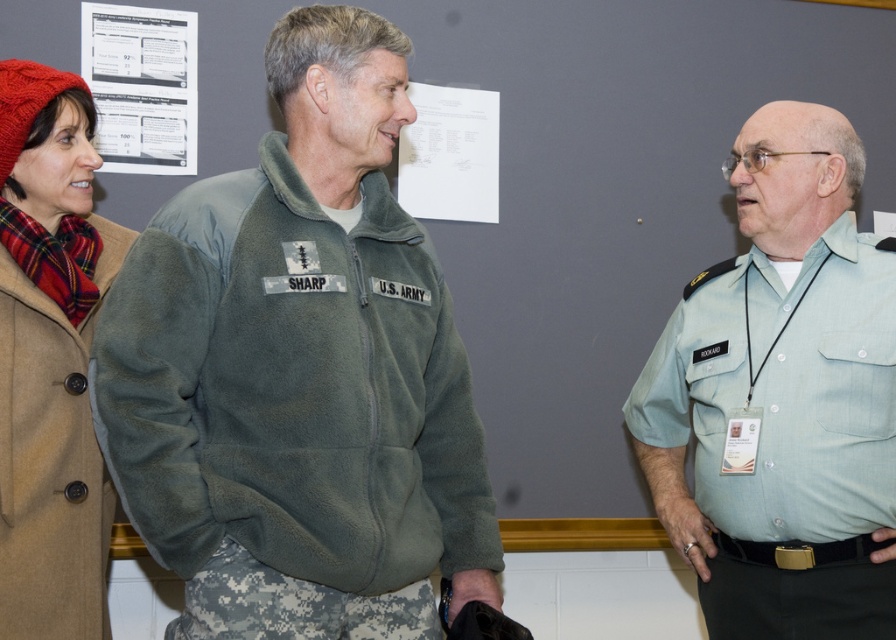
Question: Is green fleece jacket at center above white paper at upper center?

Choices:
 (A) no
 (B) yes

Answer: (A)

Question: Can you confirm if green fleece jacket at center is smaller than white paper at upper left?

Choices:
 (A) no
 (B) yes

Answer: (A)

Question: Where is light blue uniform at right located in relation to knitted wool hat at left in the image?

Choices:
 (A) left
 (B) right

Answer: (B)

Question: Based on their relative distances, which object is nearer to the light blue uniform at right?

Choices:
 (A) knitted wool hat at left
 (B) green fleece jacket at center
 (C) white paper at upper left
 (D) white paper at upper center

Answer: (B)

Question: Which is nearer to the light blue uniform at right?

Choices:
 (A) green fleece jacket at center
 (B) white paper at upper center
 (C) white paper at upper left

Answer: (A)

Question: Among these objects, which one is nearest to the camera?

Choices:
 (A) white paper at upper center
 (B) white paper at upper left
 (C) light blue uniform at right
 (D) green fleece jacket at center

Answer: (D)